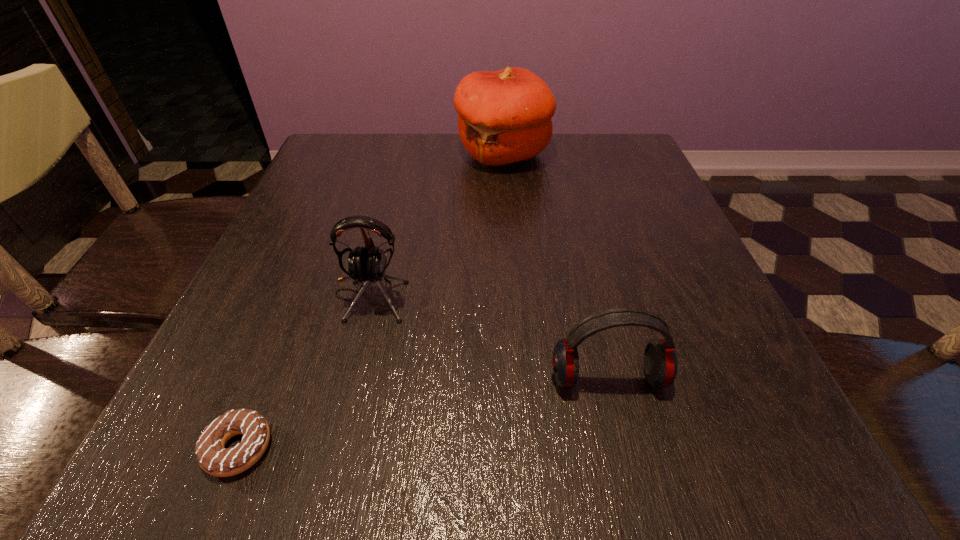
The height and width of the screenshot is (540, 960). Identify the location of vacant area situated 0.110m on the ear cups of the third farthest object. (633, 480).

I want to click on vacant point located on the right of the shortest object, so click(492, 448).

Where is `object that is positioned at the far edge`? The image size is (960, 540). object that is positioned at the far edge is located at coordinates (504, 117).

Image resolution: width=960 pixels, height=540 pixels. In order to click on object positioned at the near edge in this screenshot , I will do `click(213, 458)`.

Image resolution: width=960 pixels, height=540 pixels. I want to click on earphone present at the left edge, so click(x=368, y=264).

Find the location of a particular element. doughnut at the left edge is located at coordinates (213, 458).

Locate an element on the screen. object positioned at the right edge is located at coordinates (660, 362).

Where is `object located in the near left corner section of the desktop`? The width and height of the screenshot is (960, 540). object located in the near left corner section of the desktop is located at coordinates (213, 458).

In the image, there is a desktop. Where is `free region at the far edge`? free region at the far edge is located at coordinates (525, 173).

This screenshot has width=960, height=540. Find the location of `vacant region at the left edge of the desktop`. vacant region at the left edge of the desktop is located at coordinates coord(311,228).